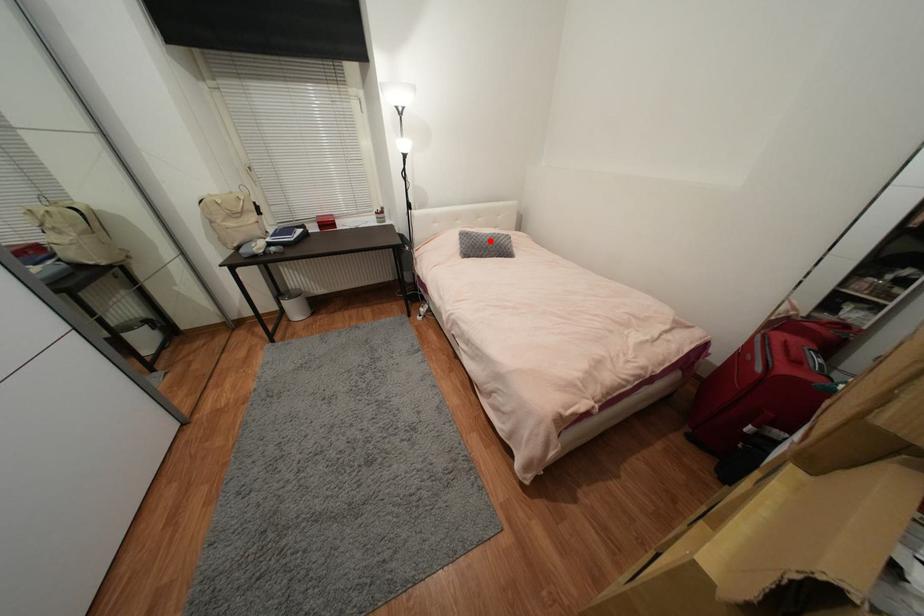
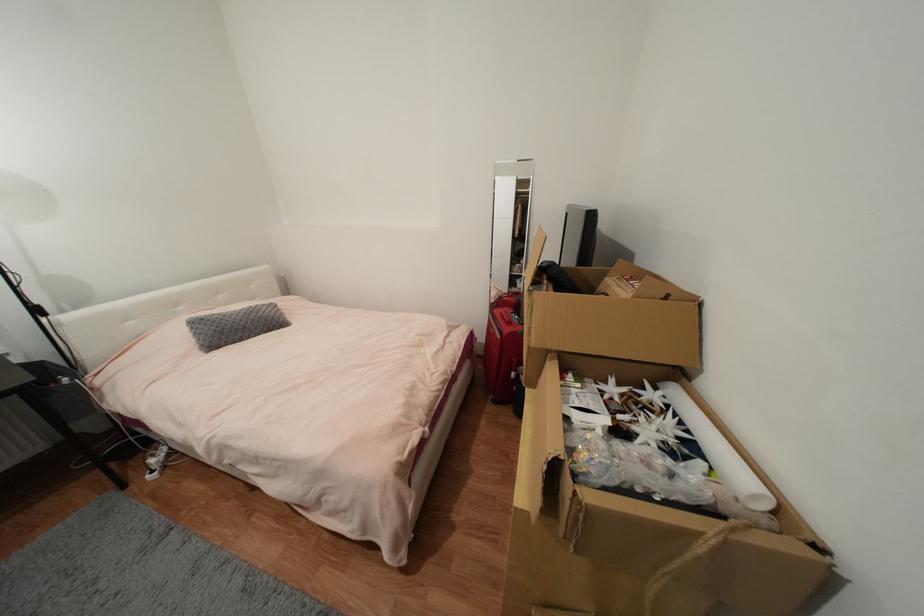
Find the pixel in the second image that matches the highlighted location in the first image.

(244, 320)